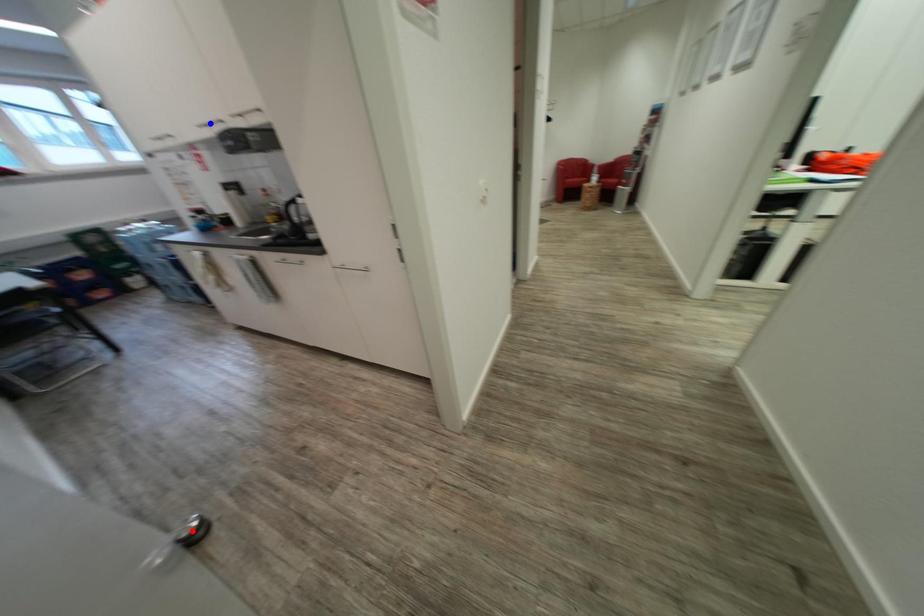
Question: Two points are marked on the image. Which point is closer to the camera?

Choices:
 (A) Blue point is closer.
 (B) Red point is closer.

Answer: (B)